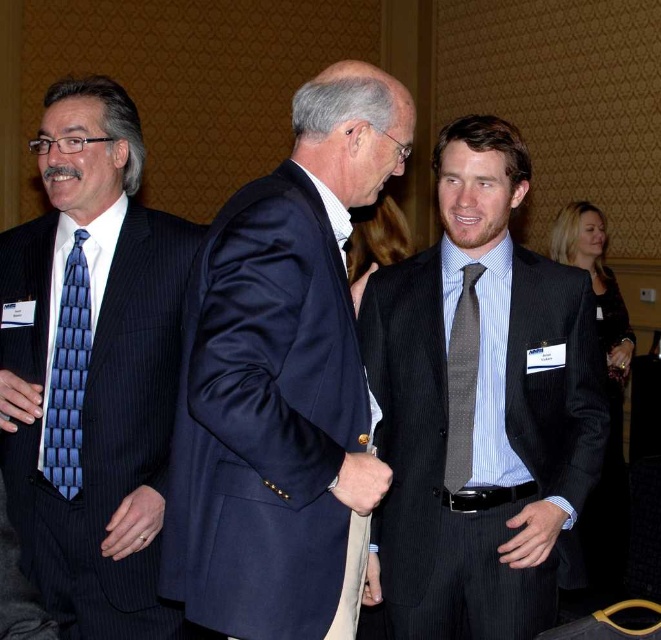
Question: From the image, what is the correct spatial relationship of navy blue suit at center in relation to blue textured tie at left?

Choices:
 (A) below
 (B) above

Answer: (B)

Question: From the image, what is the correct spatial relationship of blue textured tie at left in relation to gray textured tie at center?

Choices:
 (A) right
 (B) left

Answer: (B)

Question: Considering the real-world distances, which object is closest to the gray textured tie at center?

Choices:
 (A) blue textured tie at left
 (B) gray striped suit at right
 (C) navy blue suit at center

Answer: (B)

Question: Which object appears farthest from the camera in this image?

Choices:
 (A) blue textured tie at left
 (B) gray striped suit at right
 (C) navy blue suit at center

Answer: (A)

Question: Can you confirm if gray striped suit at right is positioned to the left of gray textured tie at center?

Choices:
 (A) no
 (B) yes

Answer: (A)

Question: Which point appears closest to the camera in this image?

Choices:
 (A) (85, 344)
 (B) (547, 493)
 (C) (467, 284)
 (D) (373, 152)

Answer: (D)